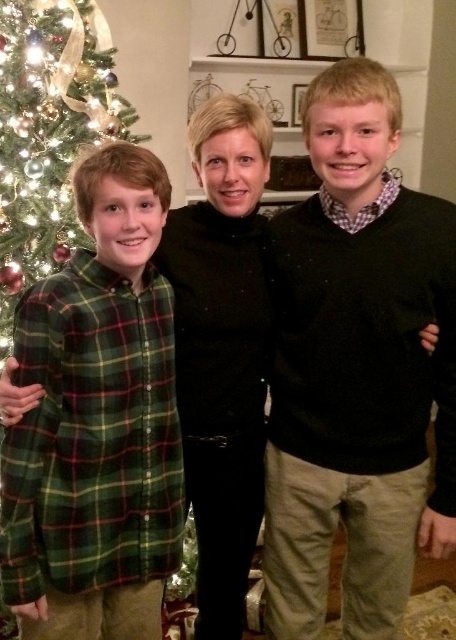
You are a photographer trying to capture a closeup of the matte black sweater at center and the green matte christmas tree at left in the same frame. Given that your camera can only focus on objects within 80 centimeters of each other, will you be able to take the photo?

The matte black sweater at center and green matte christmas tree at left are 84.44 centimeters apart from each other, which exceeds the camera focus range of 80 centimeters. Therefore, the photographer cannot capture both in focus simultaneously.

You are a photographer trying to capture a clear photo of the green plaid shirt at left and the green matte christmas tree at left. However, the tree is blocking part of the shirt. Can you adjust your position to see both fully without any obstruction?

The green plaid shirt at left is in front of the green matte christmas tree at left, so moving your camera position slightly to the side would allow you to capture both the green plaid shirt at left and the green matte christmas tree at left without obstruction.